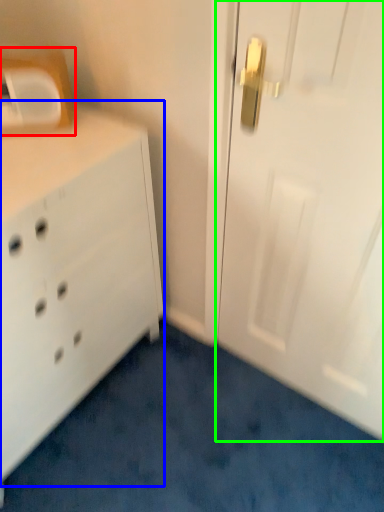
Question: Estimate the real-world distances between objects in this image. Which object is farther from medicine cabinet (highlighted by a red box), chest of drawers (highlighted by a blue box) or door (highlighted by a green box)?

Choices:
 (A) chest of drawers
 (B) door

Answer: (B)